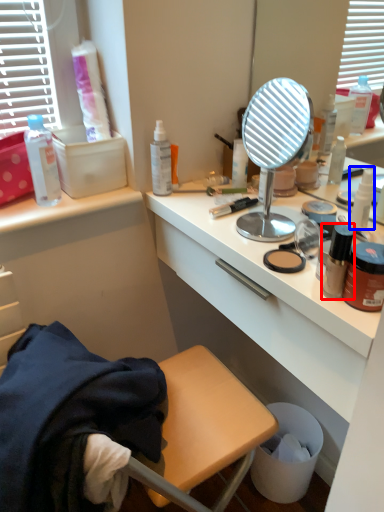
Question: Which of the following is the farthest to the observer, bottle (highlighted by a red box) or bottle (highlighted by a blue box)?

Choices:
 (A) bottle
 (B) bottle

Answer: (B)